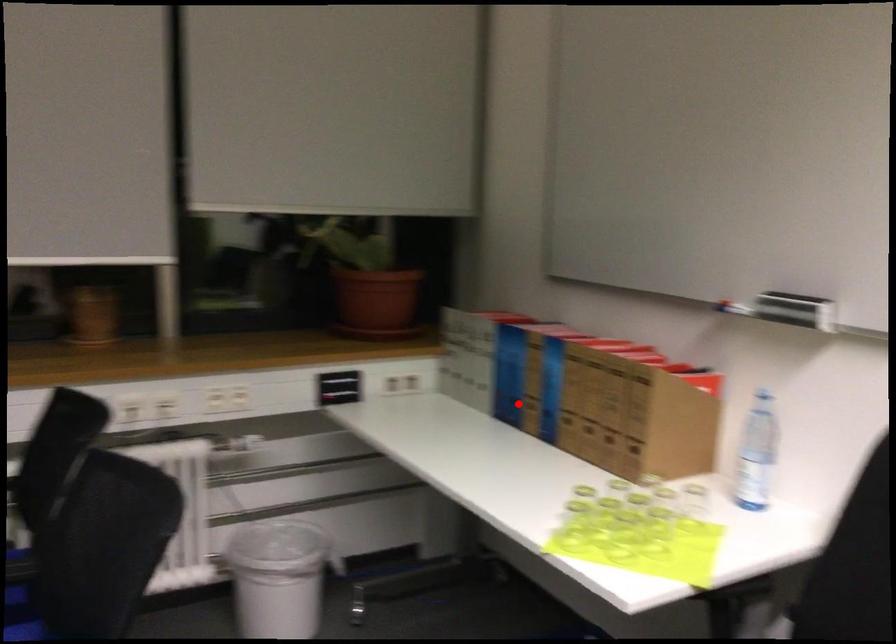
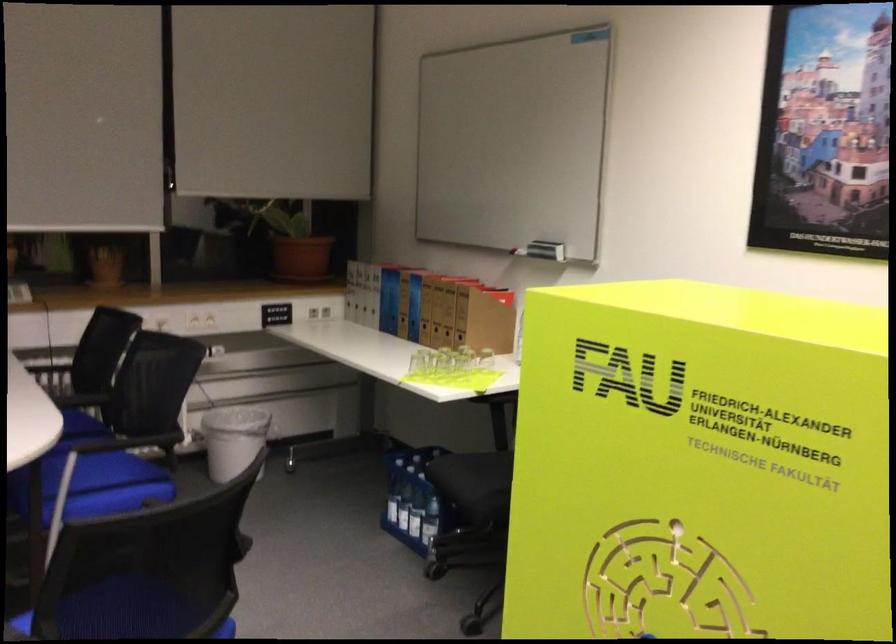
Question: I am providing you with two images of the same scene from different viewpoints. Image1 has a red point marked. In image2, the corresponding 3D location appears at what relative position? Reply with the corresponding letter.

Choices:
 (A) Closer
 (B) Farther

Answer: (B)